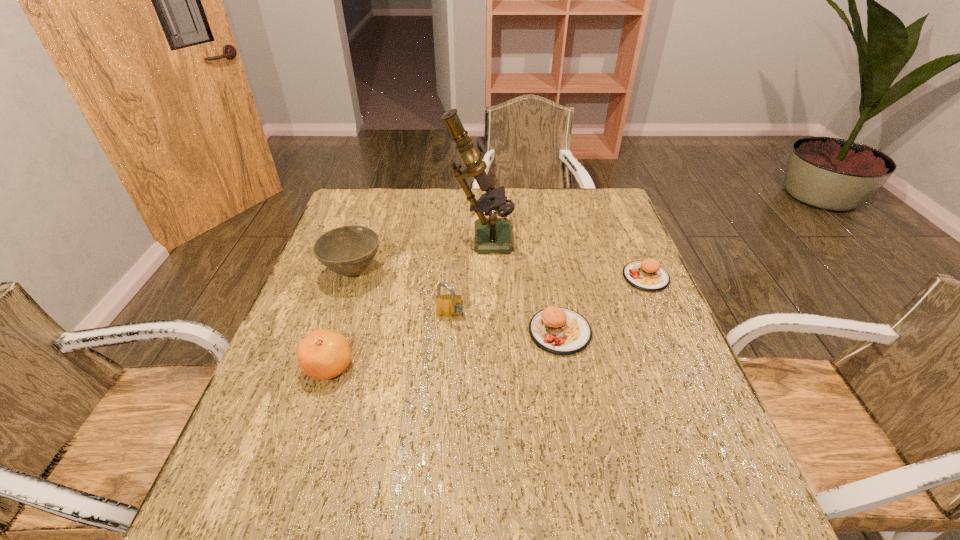
The image size is (960, 540). I want to click on free space at the left edge of the desktop, so click(x=355, y=315).

Locate an element on the screen. Image resolution: width=960 pixels, height=540 pixels. free space at the right edge is located at coordinates (656, 293).

In the image, there is a desktop. Where is `free region at the far left corner`? The image size is (960, 540). free region at the far left corner is located at coordinates click(376, 211).

At what (x,y) coordinates should I click in order to perform the action: click on free location at the far right corner. Please return your answer as a coordinate pair (x, y). This screenshot has width=960, height=540. Looking at the image, I should click on (585, 212).

The width and height of the screenshot is (960, 540). Identify the location of vacant area that lies between the rightmost object and the padlock. (548, 297).

Locate an element on the screen. unoccupied area between the third shortest object and the fifth object from left to right is located at coordinates (444, 349).

Where is `vacant area that lies between the nearer patty and the padlock`? vacant area that lies between the nearer patty and the padlock is located at coordinates (505, 324).

I want to click on free spot between the bowl and the third shortest object, so click(341, 319).

This screenshot has height=540, width=960. Identify the location of vacant area that lies between the fourth tallest object and the padlock. (390, 341).

This screenshot has width=960, height=540. Find the location of `free spot between the clementine and the padlock`. free spot between the clementine and the padlock is located at coordinates (390, 341).